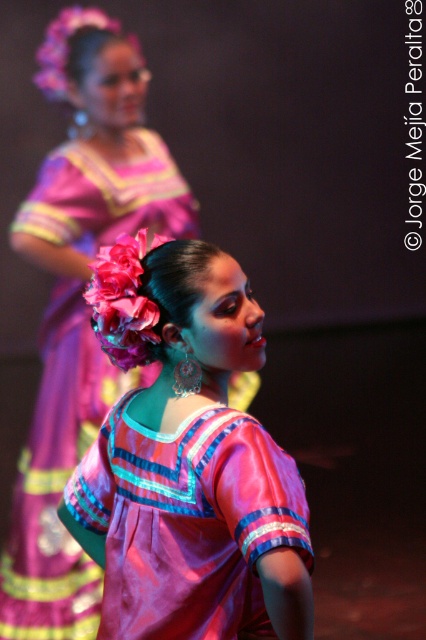
Question: Where is silky pink blouse at center located in relation to pink satin dress at center in the image?

Choices:
 (A) above
 (B) below

Answer: (B)

Question: Can you confirm if silky pink blouse at center is thinner than pink satin dress at center?

Choices:
 (A) no
 (B) yes

Answer: (B)

Question: Can you confirm if silky pink blouse at center is thinner than pink satin dress at center?

Choices:
 (A) yes
 (B) no

Answer: (A)